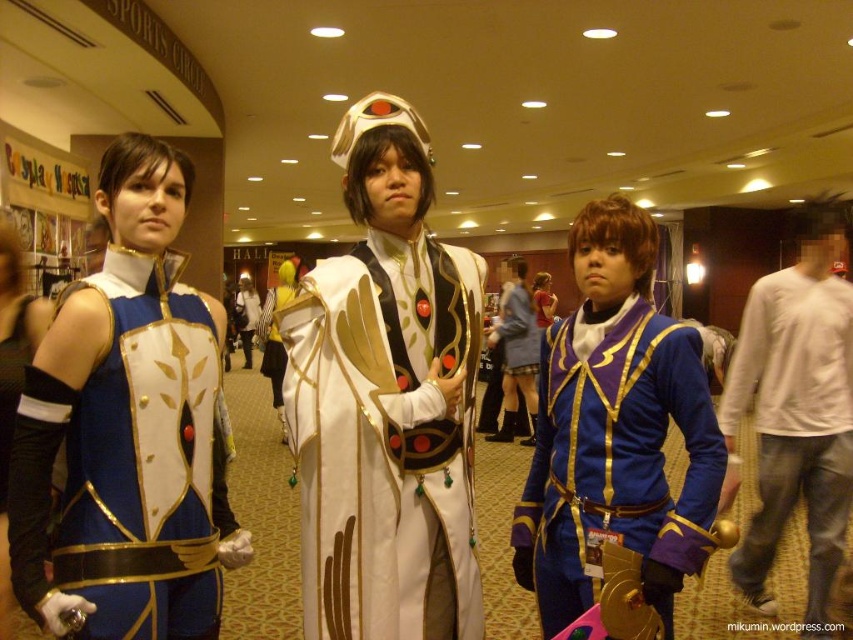
Is matte white dress at center thinner than white satin cape at center?

Indeed, matte white dress at center has a lesser width compared to white satin cape at center.

The width and height of the screenshot is (853, 640). What do you see at coordinates (518, 330) in the screenshot?
I see `matte white dress at center` at bounding box center [518, 330].

Which is in front, point (502, 321) or point (276, 374)?

Point (276, 374) is more forward.

Identify the location of matte white dress at center. (518, 330).

Which is in front, point (310, 545) or point (815, 536)?

Point (310, 545)

Does white satin robe at center have a smaller size compared to white cotton shirt at center?

Indeed, white satin robe at center has a smaller size compared to white cotton shirt at center.

Who is more forward, (375,496) or (804,420)?

Point (375,496) is in front.

Locate an element on the screen. The width and height of the screenshot is (853, 640). white satin robe at center is located at coordinates (386, 440).

Can you confirm if matte blue fabric vest at left is positioned below white satin cape at center?

Indeed, matte blue fabric vest at left is positioned under white satin cape at center.

Is matte blue fabric vest at left wider than white satin cape at center?

No, matte blue fabric vest at left is not wider than white satin cape at center.

This screenshot has width=853, height=640. Identify the location of matte blue fabric vest at left. (146, 461).